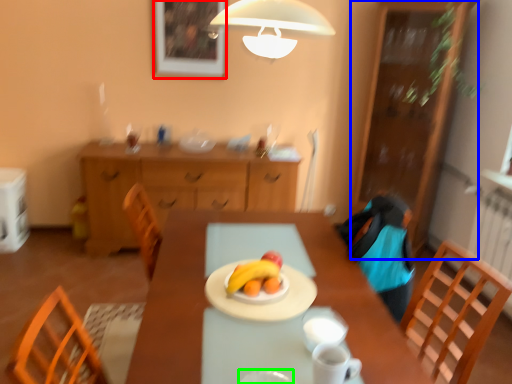
Question: Estimate the real-world distances between objects in this image. Which object is closer to picture frame (highlighted by a red box), cabinetry (highlighted by a blue box) or tableware (highlighted by a green box)?

Choices:
 (A) cabinetry
 (B) tableware

Answer: (A)